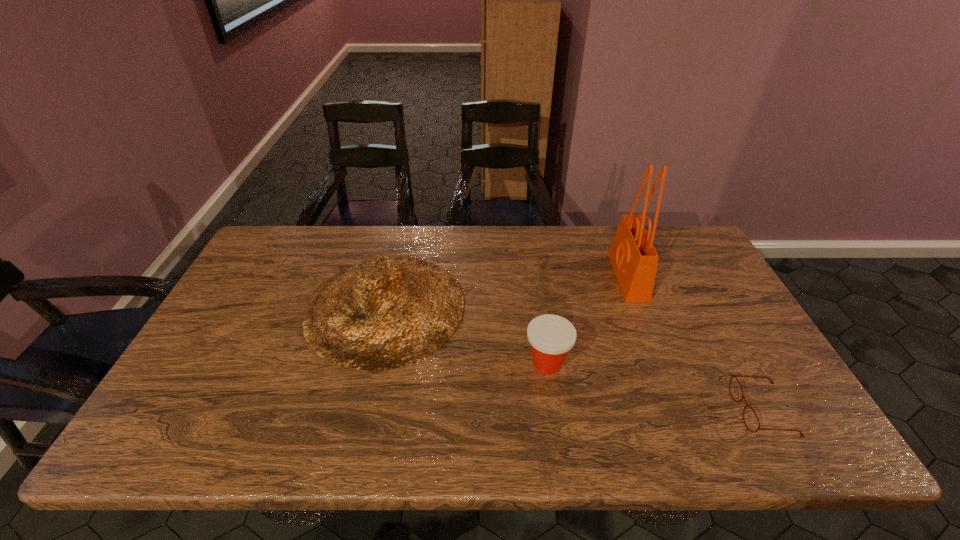
Identify the location of the second object from right to left. The width and height of the screenshot is (960, 540). (634, 259).

Locate an element on the screen. tote bag is located at coordinates (634, 259).

The width and height of the screenshot is (960, 540). I want to click on the leftmost object, so click(387, 312).

In order to click on sunhat in this screenshot , I will do `click(387, 312)`.

Locate an element on the screen. Image resolution: width=960 pixels, height=540 pixels. the second object from left to right is located at coordinates (551, 337).

At what (x,y) coordinates should I click in order to perform the action: click on Dixie cup. Please return your answer as a coordinate pair (x, y). The width and height of the screenshot is (960, 540). Looking at the image, I should click on (551, 337).

Find the location of a particular element. the shortest object is located at coordinates (732, 376).

Locate an element on the screen. The image size is (960, 540). spectacles is located at coordinates (732, 376).

Where is `free location located 0.160m on the logo side of the tallest object`? The width and height of the screenshot is (960, 540). free location located 0.160m on the logo side of the tallest object is located at coordinates (564, 276).

Where is `vacant region located 0.190m on the logo side of the tallest object`? This screenshot has height=540, width=960. vacant region located 0.190m on the logo side of the tallest object is located at coordinates click(554, 276).